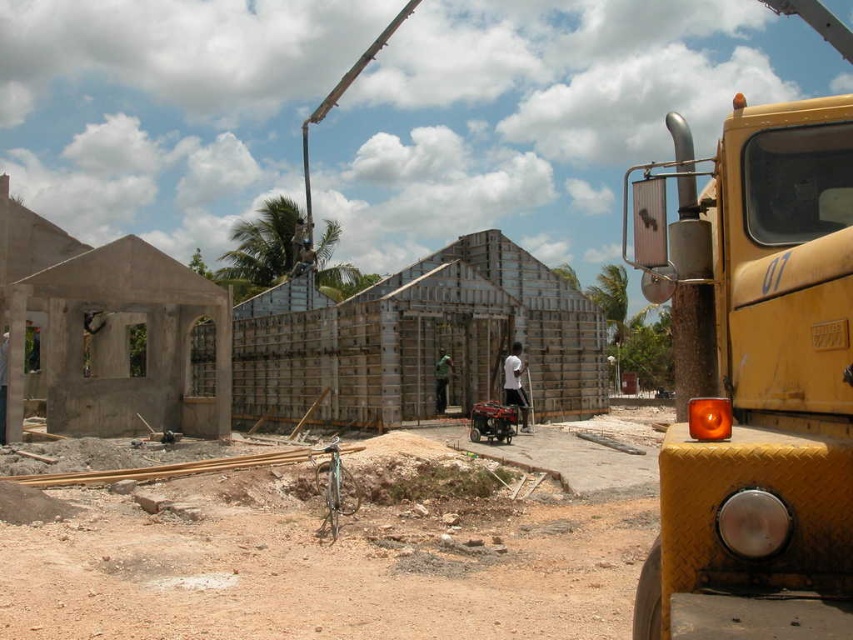
Question: Does yellow metallic school bus at right appear on the left side of white matte shirt at center?

Choices:
 (A) no
 (B) yes

Answer: (A)

Question: Which object is closer to the camera taking this photo?

Choices:
 (A) brown dirt track at center
 (B) white matte shirt at center

Answer: (A)

Question: Does brown dirt track at center have a larger size compared to black metallic crane at upper center?

Choices:
 (A) yes
 (B) no

Answer: (B)

Question: Which object is closer to the camera taking this photo?

Choices:
 (A) black metallic crane at upper center
 (B) brown dirt track at center

Answer: (B)

Question: Can you confirm if brown dirt track at center is wider than black metallic crane at upper center?

Choices:
 (A) no
 (B) yes

Answer: (A)

Question: Estimate the real-world distances between objects in this image. Which object is closer to the dark green fabric at center?

Choices:
 (A) brown dirt track at center
 (B) yellow metallic school bus at right
 (C) white matte shirt at center

Answer: (C)